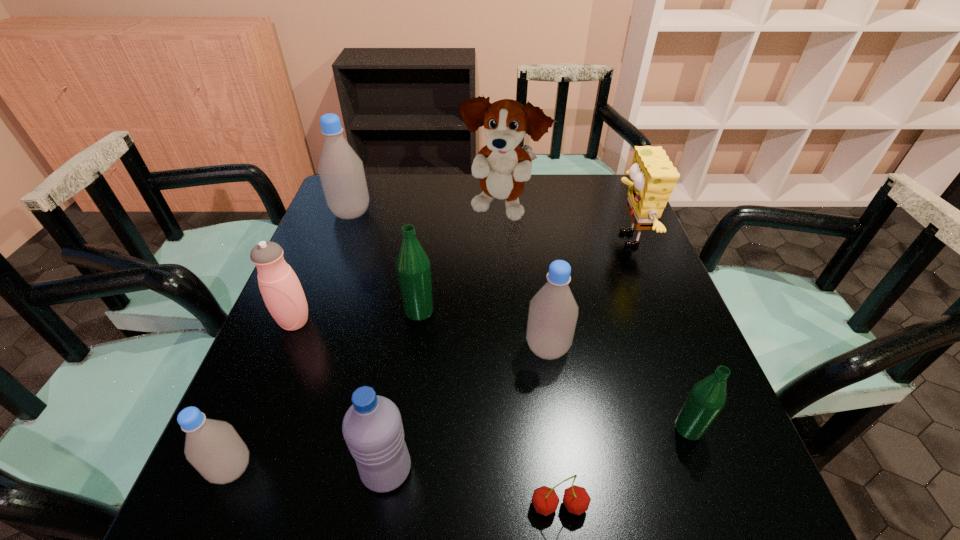
This screenshot has height=540, width=960. I want to click on free point located 0.260m on the back of the rightmost gray bottle, so click(x=535, y=256).

Where is `vacant space located 0.100m on the back of the farther green bottle`? The width and height of the screenshot is (960, 540). vacant space located 0.100m on the back of the farther green bottle is located at coordinates coord(424,272).

Image resolution: width=960 pixels, height=540 pixels. In order to click on free location located 0.080m on the right of the thermos bottle in this screenshot , I will do `click(348, 322)`.

Find the location of a particular element. Image resolution: width=960 pixels, height=540 pixels. blank area located 0.180m on the left of the blue water bottle is located at coordinates (257, 470).

You are a GUI agent. You are given a task and a screenshot of the screen. Output one action in this format:
    pyautogui.click(x=<x>, y=<y>)
    Task: Click on the free location located on the left of the smaller green bottle
    The width and height of the screenshot is (960, 540).
    Given the screenshot: What is the action you would take?
    (631, 428)

Identify the location of free space located 0.120m on the back of the smallest gray bottle. (264, 390).

I want to click on puppy situated at the far edge, so click(x=502, y=165).

Image resolution: width=960 pixels, height=540 pixels. I want to click on bottle that is at the far edge, so click(x=341, y=171).

Locate an element on the screen. This screenshot has height=540, width=960. sponge that is at the far edge is located at coordinates (652, 180).

Locate an element on the screen. water bottle that is at the near edge is located at coordinates (372, 427).